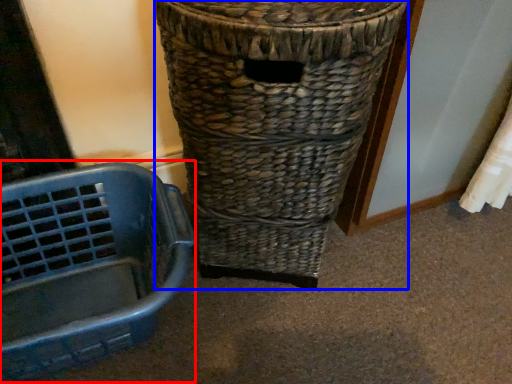
Question: Which of the following is the farthest to the observer, basket container (highlighted by a red box) or waste container (highlighted by a blue box)?

Choices:
 (A) basket container
 (B) waste container

Answer: (A)